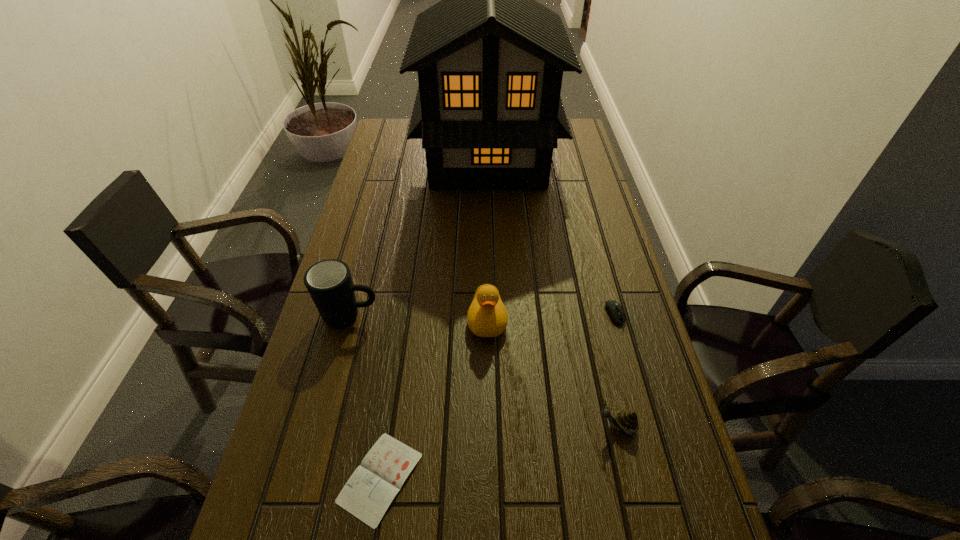
Where is `vacant point that satisfies the following two spatial constraints: 1. on the side of the diary with the handle; 2. on the left side of the mug`? The width and height of the screenshot is (960, 540). vacant point that satisfies the following two spatial constraints: 1. on the side of the diary with the handle; 2. on the left side of the mug is located at coordinates (308, 478).

You are a GUI agent. You are given a task and a screenshot of the screen. Output one action in this format:
    pyautogui.click(x=<x>, y=<y>)
    Task: Click on the vacant area in the image that satisfies the following two spatial constraints: 1. on the front side of the fifth tallest object; 2. on the face of the snail
    The height and width of the screenshot is (540, 960).
    Given the screenshot: What is the action you would take?
    pyautogui.click(x=645, y=426)